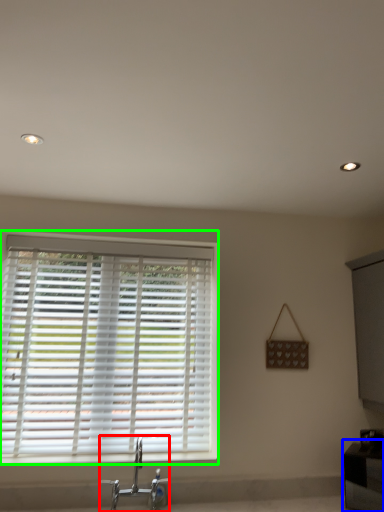
Question: Considering the real-world distances, which object is closest to tap (highlighted by a red box)? vanity (highlighted by a blue box) or window blind (highlighted by a green box).

Choices:
 (A) vanity
 (B) window blind

Answer: (B)